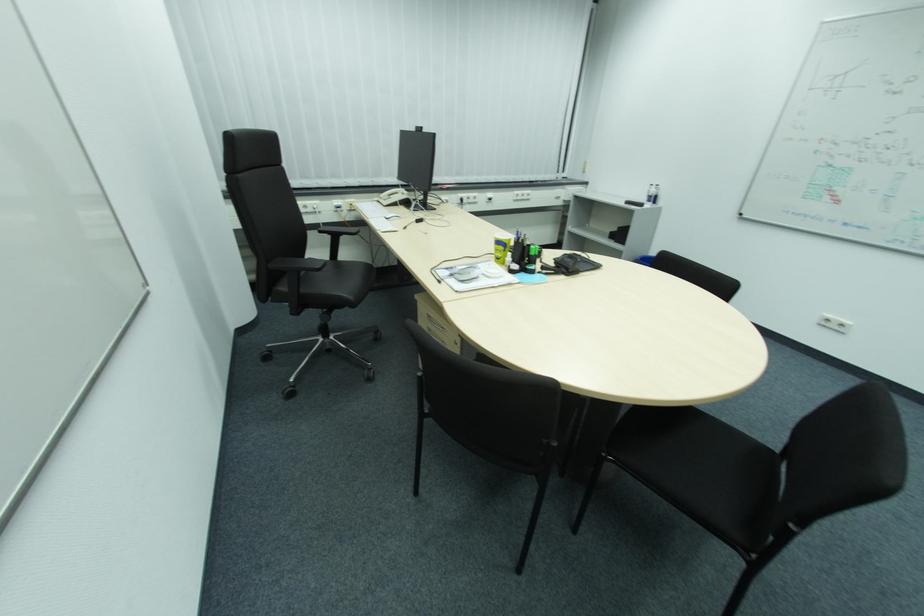
Describe the element at coordinates (300, 269) in the screenshot. The height and width of the screenshot is (616, 924). I see `the black chair sitting surface` at that location.